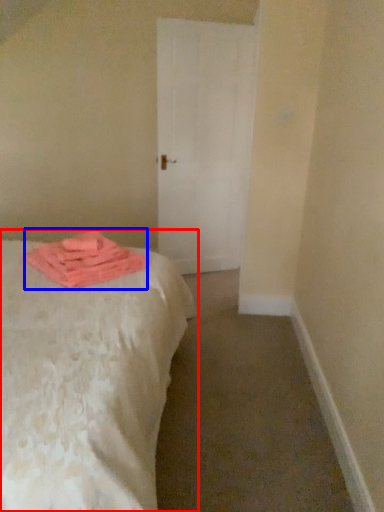
Question: Which object appears farthest to the camera in this image, bed (highlighted by a red box) or material (highlighted by a blue box)?

Choices:
 (A) bed
 (B) material

Answer: (B)